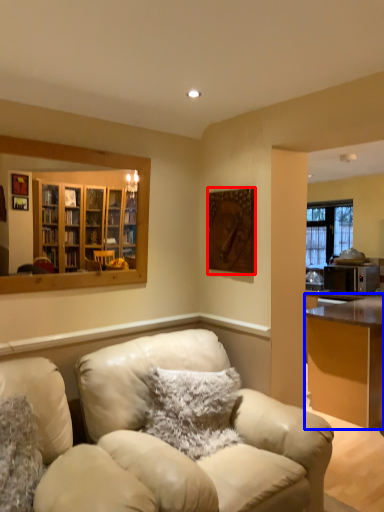
Question: Which point is further to the camera, picture frame (highlighted by a red box) or desk (highlighted by a blue box)?

Choices:
 (A) picture frame
 (B) desk

Answer: (B)